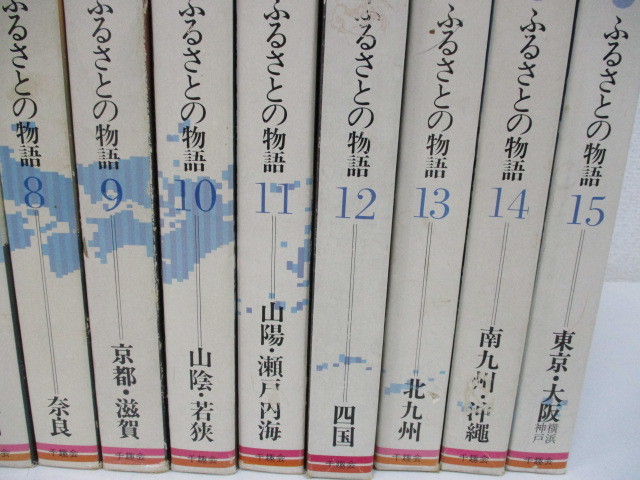
At what (x,y) coordinates should I click in order to perform the action: click on book 9. Please return your answer as a coordinate pair (x, y). The width and height of the screenshot is (640, 480). Looking at the image, I should click on (109, 199).